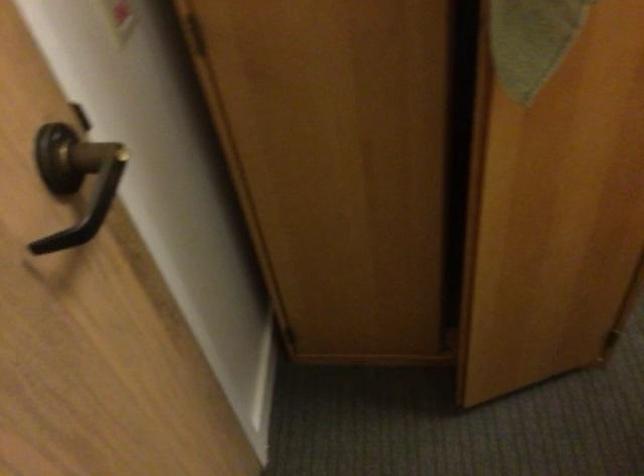
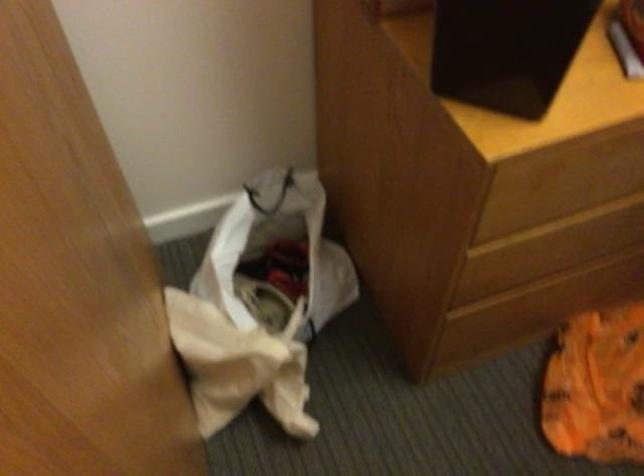
Question: How did the camera likely rotate?

Choices:
 (A) Left
 (B) Right
 (C) Up
 (D) Down

Answer: (B)